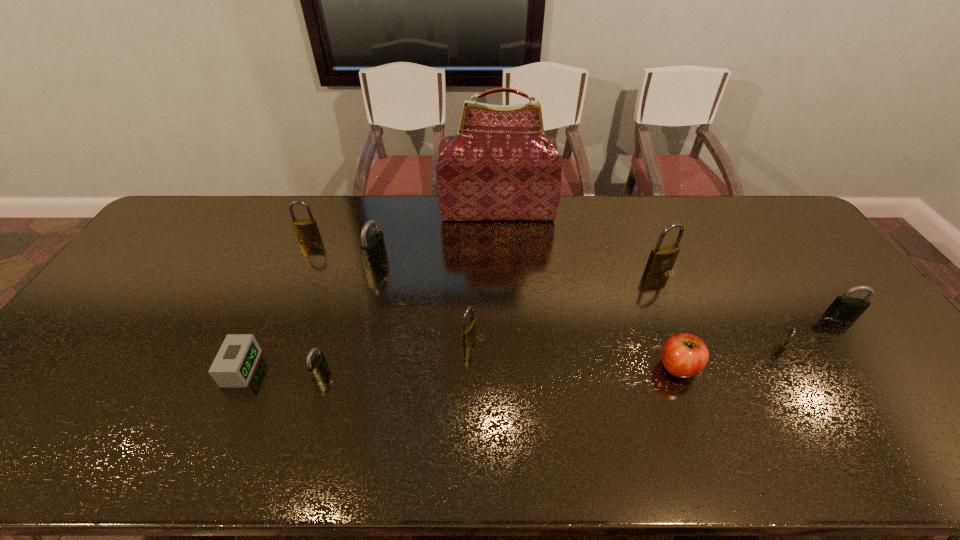
I want to click on vacant area between the second nearest black padlock and the farthest padlock, so click(x=575, y=277).

Where is `free spot between the rightmost brass padlock and the apple`? The height and width of the screenshot is (540, 960). free spot between the rightmost brass padlock and the apple is located at coordinates (729, 359).

Locate an element on the screen. free point between the fifth padlock from right to left and the nearest black padlock is located at coordinates (348, 316).

Where is `vacant area between the smallest black padlock and the second padlock from right to left`? The image size is (960, 540). vacant area between the smallest black padlock and the second padlock from right to left is located at coordinates (549, 362).

What are the coordinates of `free space between the farthest brass padlock and the leftmost black padlock` in the screenshot? It's located at (315, 306).

The height and width of the screenshot is (540, 960). Identify the location of the seventh closest object to the fourth farthest padlock. (317, 367).

Locate which object ranks fourth in proximity to the smallest brass padlock. Please provide its 2D coordinates. Your answer should be formatted as a tuple, i.e. [(x, y)], where the tuple contains the x and y coordinates of a point satisfying the conditions above.

[(500, 166)]

Locate an element on the screen. the closest padlock to the farthest black padlock is located at coordinates (306, 229).

The height and width of the screenshot is (540, 960). Identify the location of padlock that is the sixth closest to the biggest brass padlock. (306, 229).

Find the location of `brass padlock that is the second closest to the third brass padlock from right to left`. brass padlock that is the second closest to the third brass padlock from right to left is located at coordinates (306, 229).